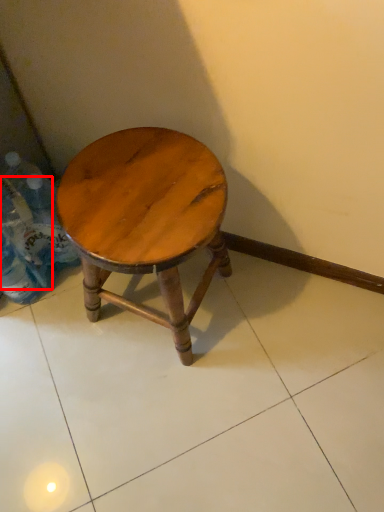
Question: In this image, where is bottle (annotated by the red box) located relative to stool?

Choices:
 (A) right
 (B) left

Answer: (B)